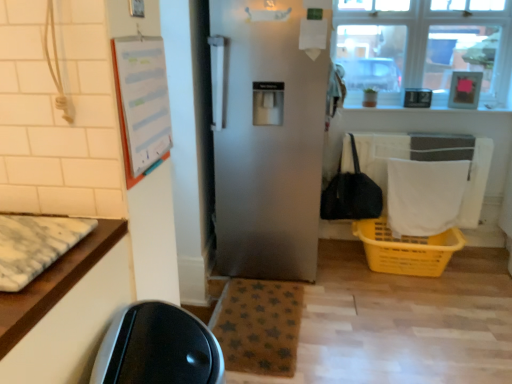
Question: In terms of width, does clear glass window at upper right look wider or thinner when compared to black fabric handbag at right?

Choices:
 (A) thin
 (B) wide

Answer: (A)

Question: Is point (490, 29) closer or farther from the camera than point (368, 206)?

Choices:
 (A) farther
 (B) closer

Answer: (B)

Question: Which object is positioned farthest from the white fabric laundry at lower right?

Choices:
 (A) satin silver refrigerator at center
 (B) black fabric handbag at right
 (C) white marble mat at left, arranged as the 1th mat when viewed from the top
 (D) yellow plastic basket at lower right
 (E) brown star-patterned mat at lower center, which ranks as the first mat in bottom-to-top order

Answer: (C)

Question: Which is farther from the white paperboard at upper left?

Choices:
 (A) clear glass window at upper right
 (B) brown star-patterned mat at lower center, which ranks as the second mat in left-to-right order
 (C) yellow plastic basket at lower right
 (D) white marble mat at left, which ranks as the 1th mat in front-to-back order
 (E) black fabric handbag at right

Answer: (A)